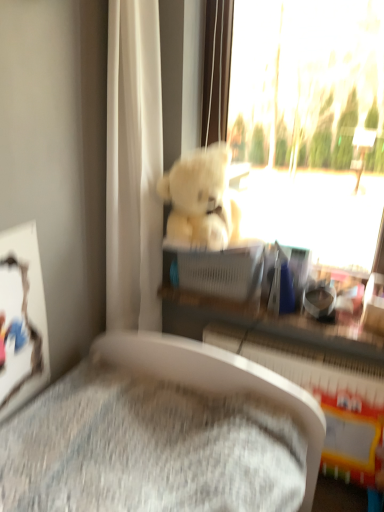
Question: From the image's perspective, relative to white plush bear at upper center, is white plastic radiator at lower center above or below?

Choices:
 (A) below
 (B) above

Answer: (A)

Question: Is white plastic radiator at lower center in front of or behind white plush bear at upper center in the image?

Choices:
 (A) front
 (B) behind

Answer: (B)

Question: Which object is positioned closest to the white fabric curtain at upper center?

Choices:
 (A) white plastic radiator at lower center
 (B) white plush bear at upper center
 (C) fluffy white teddy bear at upper center
 (D) matte plastic shelf at center

Answer: (C)

Question: Considering the real-world distances, which object is farthest from the fluffy white teddy bear at upper center?

Choices:
 (A) white plastic radiator at lower center
 (B) white plush bear at upper center
 (C) white fabric curtain at upper center
 (D) matte plastic shelf at center

Answer: (A)